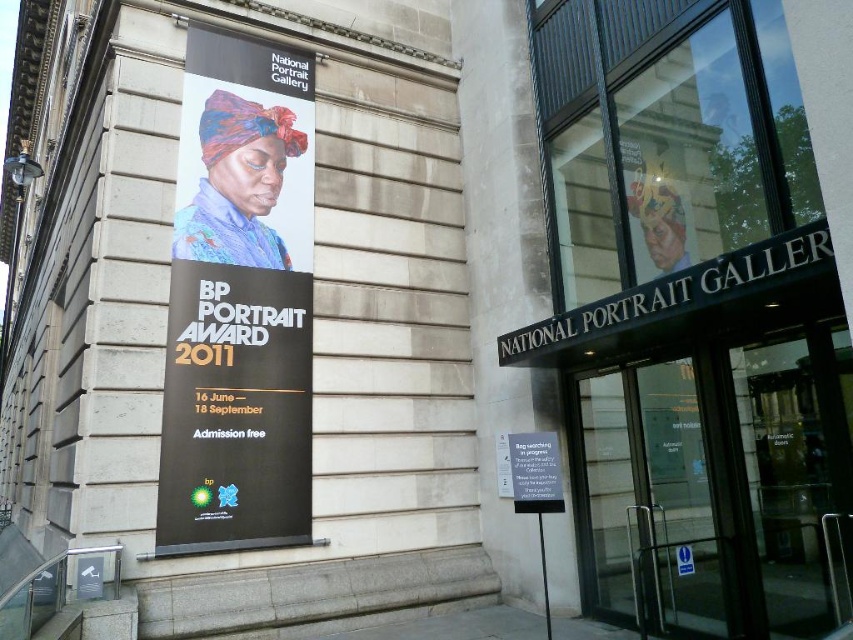
Question: Which point is farther to the camera?

Choices:
 (A) white plastic sign at center
 (B) matte black banner at upper left
 (C) transparent glass door at center

Answer: (B)

Question: Considering the relative positions of matte black banner at upper left and white plastic sign at center in the image provided, where is matte black banner at upper left located with respect to white plastic sign at center?

Choices:
 (A) left
 (B) right

Answer: (A)

Question: Which of the following is the farthest from the observer?

Choices:
 (A) (631, 401)
 (B) (292, 300)

Answer: (B)

Question: Which object is the farthest from the white plastic sign at center?

Choices:
 (A) transparent glass door at center
 (B) matte black banner at upper left

Answer: (B)

Question: Does transparent glass door at center appear over white plastic sign at center?

Choices:
 (A) no
 (B) yes

Answer: (A)

Question: Is transparent glass door at center further to the viewer compared to white plastic sign at center?

Choices:
 (A) no
 (B) yes

Answer: (B)